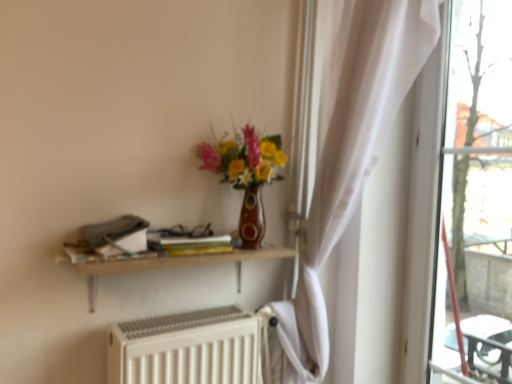
Question: Is point (162, 360) closer or farther from the camera than point (165, 236)?

Choices:
 (A) farther
 (B) closer

Answer: (B)

Question: Based on their sizes in the image, would you say white matte radiator at lower center is bigger or smaller than yellow matte book at center?

Choices:
 (A) big
 (B) small

Answer: (A)

Question: Which of these objects is positioned closest to the yellow matte book at center?

Choices:
 (A) matte ceramic vase at center
 (B) white matte radiator at lower center
 (C) wooden shelf at upper center

Answer: (C)

Question: Estimate the real-world distances between objects in this image. Which object is closer to the yellow matte book at center?

Choices:
 (A) matte ceramic vase at center
 (B) wooden shelf at upper center
 (C) white matte radiator at lower center

Answer: (B)